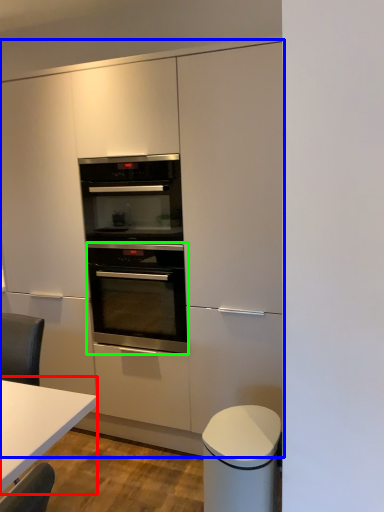
Question: Which object is positioned farthest from table (highlighted by a red box)? Select from cabinetry (highlighted by a blue box) and oven (highlighted by a green box).

Choices:
 (A) cabinetry
 (B) oven

Answer: (A)